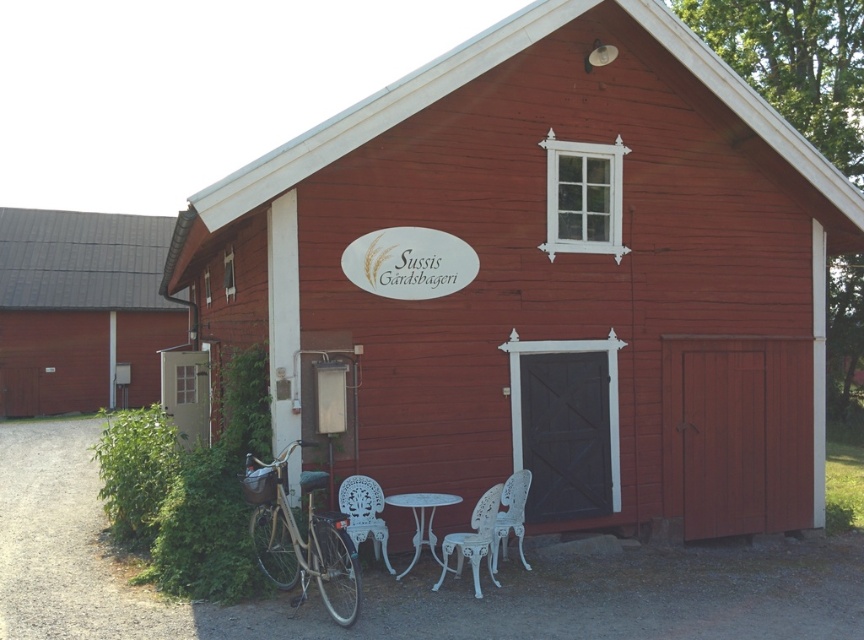
Question: Does smooth wooden barn at center come behind brown wooden door at left?

Choices:
 (A) yes
 (B) no

Answer: (B)

Question: Based on their relative distances, which object is farther from the white metal table at lower center?

Choices:
 (A) smooth wooden barn at center
 (B) brown wooden door at left
 (C) white wicker chair at lower center

Answer: (B)

Question: From the image, what is the correct spatial relationship of smooth wooden barn at center in relation to white wicker chair at lower center?

Choices:
 (A) above
 (B) below

Answer: (A)

Question: Which object appears farthest from the camera in this image?

Choices:
 (A) white metal table at lower center
 (B) smooth wooden barn at center

Answer: (A)

Question: From the image, what is the correct spatial relationship of smooth wooden barn at center in relation to white wicker chair at lower center?

Choices:
 (A) below
 (B) above

Answer: (B)

Question: Which point appears farthest from the camera in this image?

Choices:
 (A) (99, 237)
 (B) (357, 524)

Answer: (A)